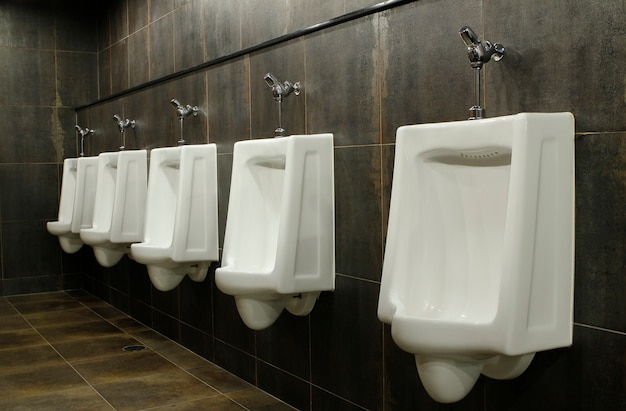
The height and width of the screenshot is (411, 626). Find the location of `urinals`. urinals is located at coordinates (481, 206), (270, 199), (171, 194), (111, 198), (78, 201).